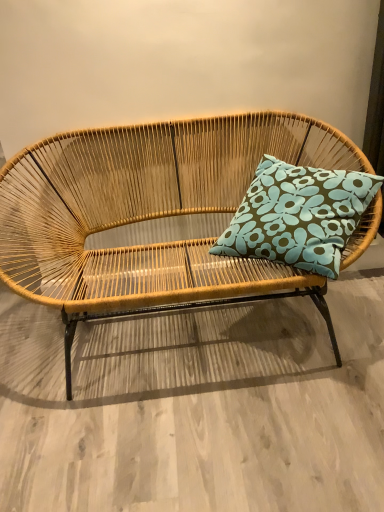
Locate an element on the screen. The image size is (384, 512). vacant space underneath natural woven studio couch at center (from a real-world perspective) is located at coordinates (190, 340).